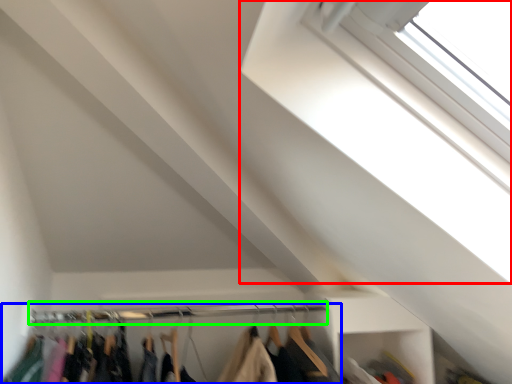
Question: Which object is the farthest from window (highlighted by a red box)? Choose among these: closet (highlighted by a blue box) or clothesline (highlighted by a green box).

Choices:
 (A) closet
 (B) clothesline

Answer: (A)